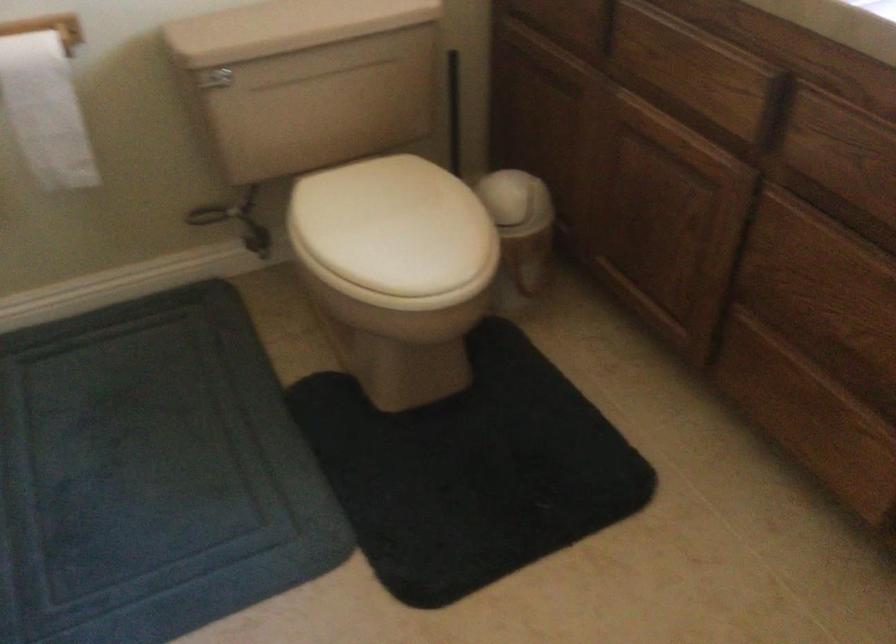
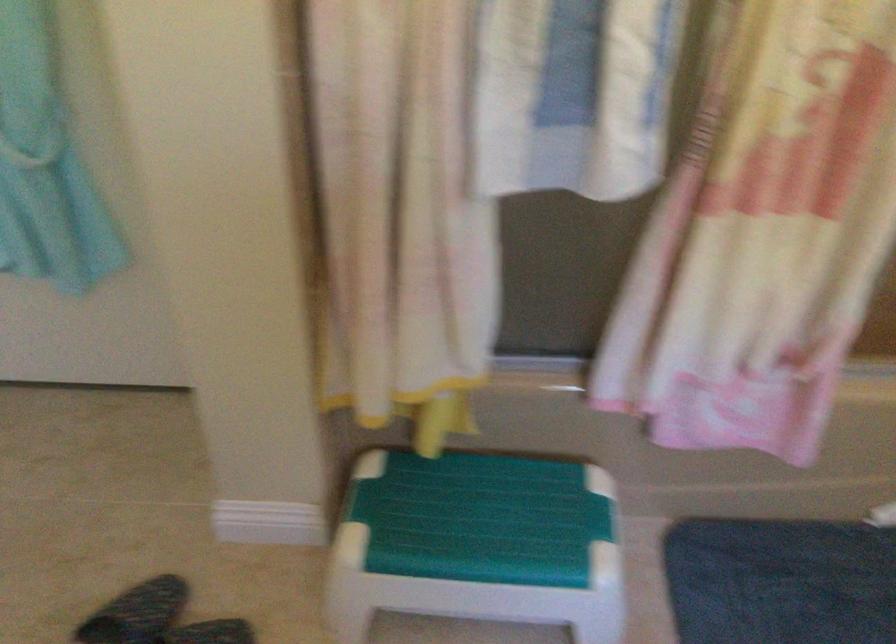
Based on the continuous images, in which direction is the camera rotating?

The rotation direction of the camera is left-down.